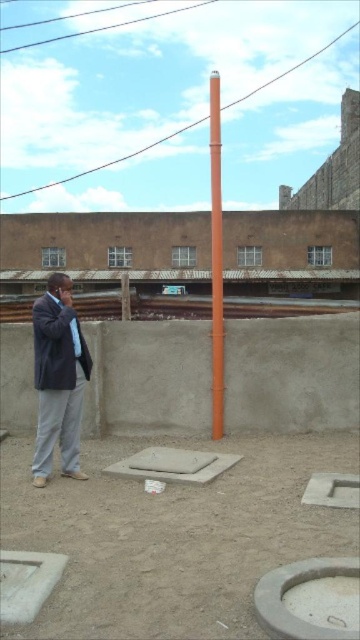
Can you confirm if concrete at lower right is positioned below gray concrete manhole at center?

Indeed, concrete at lower right is positioned under gray concrete manhole at center.

Is concrete at lower right to the left of gray concrete manhole at center from the viewer's perspective?

Incorrect, concrete at lower right is not on the left side of gray concrete manhole at center.

Is point (353, 564) more distant than point (168, 468)?

That is False.

Where is `concrete at lower right`? The width and height of the screenshot is (360, 640). concrete at lower right is located at coordinates (294, 584).

Is concrete at lower right positioned before orange matte pole at center?

Yes, concrete at lower right is closer to the viewer.

Measure the distance from concrete at lower right to orange matte pole at center.

concrete at lower right and orange matte pole at center are 15.72 meters apart.

At what (x,y) coordinates should I click in order to perform the action: click on concrete at lower right. Please return your answer as a coordinate pair (x, y). The height and width of the screenshot is (640, 360). Looking at the image, I should click on (294, 584).

Who is more distant from viewer, (81,355) or (309,566)?

Point (81,355)

Does dark gray suit at left have a greater height compared to concrete at lower right?

Yes.

The width and height of the screenshot is (360, 640). In order to click on dark gray suit at left in this screenshot , I will do `click(57, 378)`.